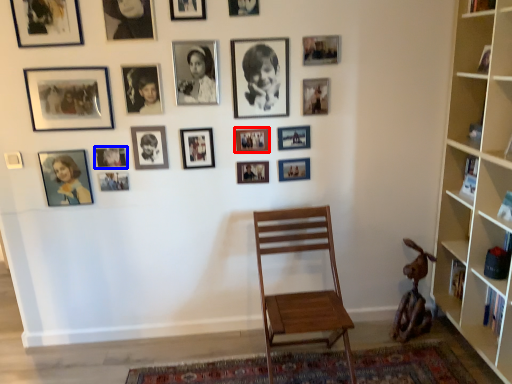
Question: Which object is closer to the camera taking this photo, picture frame (highlighted by a red box) or picture frame (highlighted by a blue box)?

Choices:
 (A) picture frame
 (B) picture frame

Answer: (B)